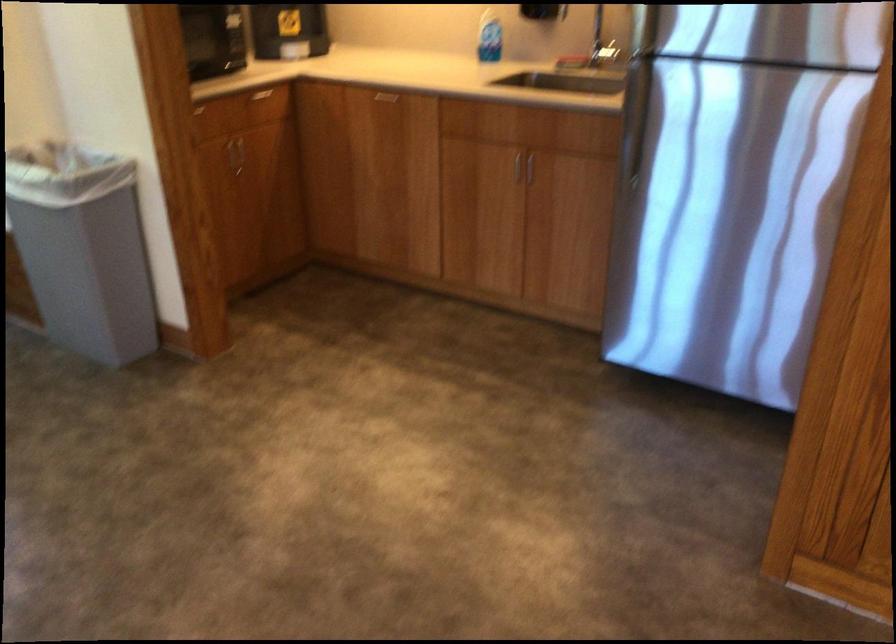
Find where to pull the silver drawer handle. Please return your answer as a coordinate pair (x, y).

(524, 166)